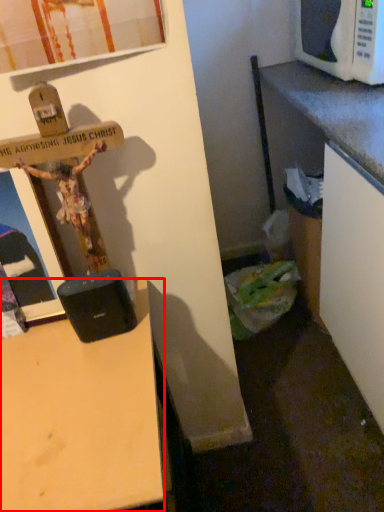
Question: From the image's perspective, where is desk (annotated by the red box) located in relation to microwave oven in the image?

Choices:
 (A) above
 (B) below

Answer: (B)